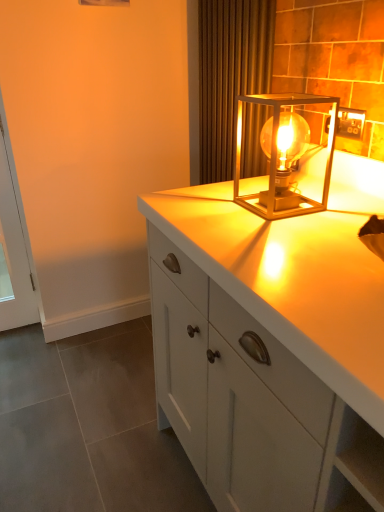
Question: Can you confirm if metallic gold outlet at upper right is bigger than white glossy cabinet at center?

Choices:
 (A) no
 (B) yes

Answer: (A)

Question: Is the surface of metallic gold outlet at upper right in direct contact with white glossy cabinet at center?

Choices:
 (A) yes
 (B) no

Answer: (B)

Question: Is metallic gold outlet at upper right further to the viewer compared to white glossy cabinet at center?

Choices:
 (A) yes
 (B) no

Answer: (A)

Question: Is white glossy cabinet at center a part of metallic gold outlet at upper right?

Choices:
 (A) yes
 (B) no

Answer: (B)

Question: From the image's perspective, is metallic gold outlet at upper right above white glossy cabinet at center?

Choices:
 (A) no
 (B) yes

Answer: (B)

Question: In terms of height, does metallic gold lamp at upper right look taller or shorter compared to white glossy cabinet at center?

Choices:
 (A) tall
 (B) short

Answer: (B)

Question: Considering the relative positions of metallic gold lamp at upper right and white glossy cabinet at center in the image provided, is metallic gold lamp at upper right to the left or to the right of white glossy cabinet at center?

Choices:
 (A) right
 (B) left

Answer: (B)

Question: Is metallic gold lamp at upper right inside the boundaries of white glossy cabinet at center, or outside?

Choices:
 (A) outside
 (B) inside

Answer: (A)

Question: Is metallic gold lamp at upper right bigger or smaller than white glossy cabinet at center?

Choices:
 (A) small
 (B) big

Answer: (A)

Question: From a real-world perspective, is metallic gold outlet at upper right physically located above or below white glossy cabinet at center?

Choices:
 (A) below
 (B) above

Answer: (B)

Question: Is metallic gold outlet at upper right taller or shorter than white glossy cabinet at center?

Choices:
 (A) tall
 (B) short

Answer: (B)

Question: Considering the relative positions of metallic gold outlet at upper right and white glossy cabinet at center in the image provided, is metallic gold outlet at upper right to the left or to the right of white glossy cabinet at center?

Choices:
 (A) right
 (B) left

Answer: (A)

Question: In terms of size, does metallic gold outlet at upper right appear bigger or smaller than white glossy cabinet at center?

Choices:
 (A) small
 (B) big

Answer: (A)

Question: Is white glass screen door at left spatially inside brown textured curtain at upper center, or outside of it?

Choices:
 (A) inside
 (B) outside

Answer: (B)

Question: Considering the positions of point (1, 106) and point (218, 53), is point (1, 106) closer or farther from the camera than point (218, 53)?

Choices:
 (A) closer
 (B) farther

Answer: (B)